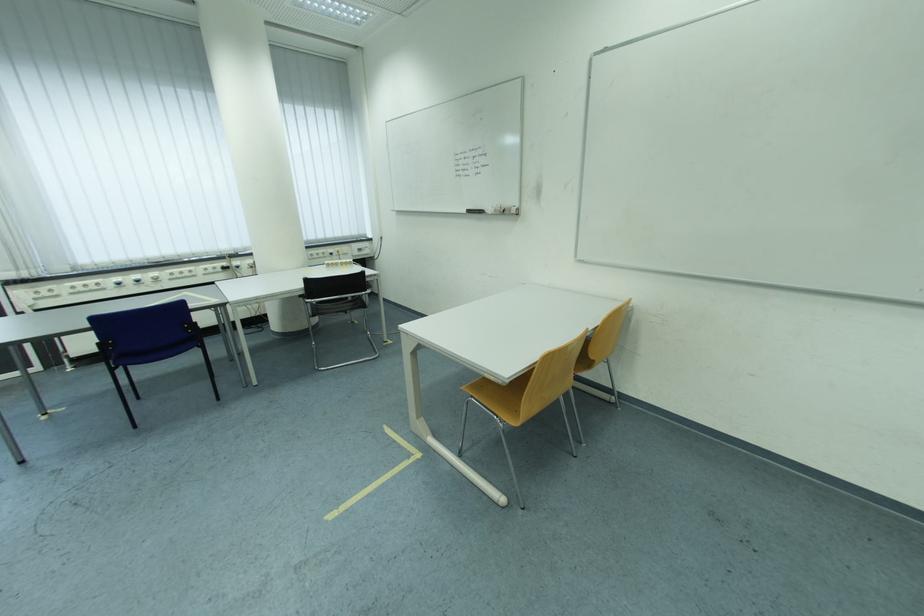
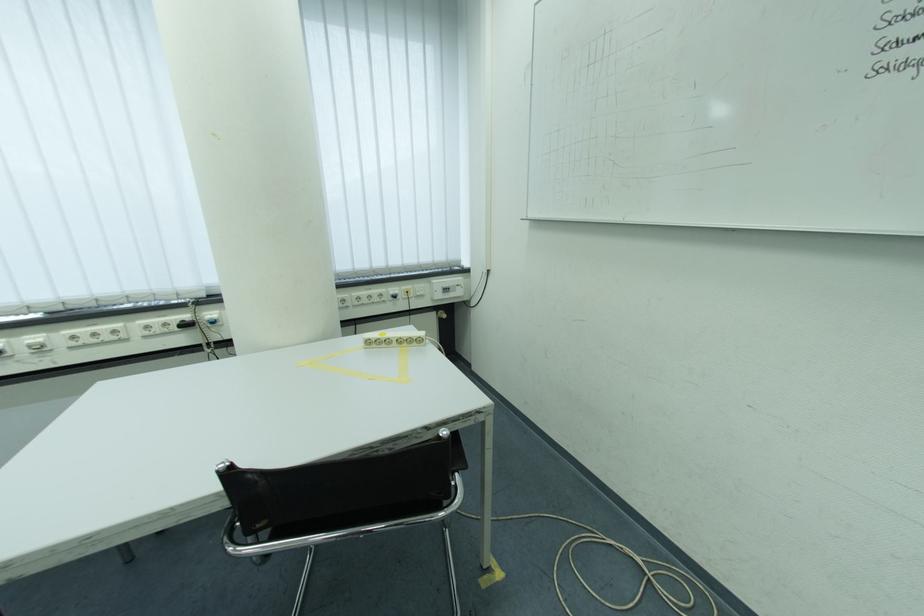
In the second image, find the point that corresponds to point (369, 253) in the first image.

(455, 292)